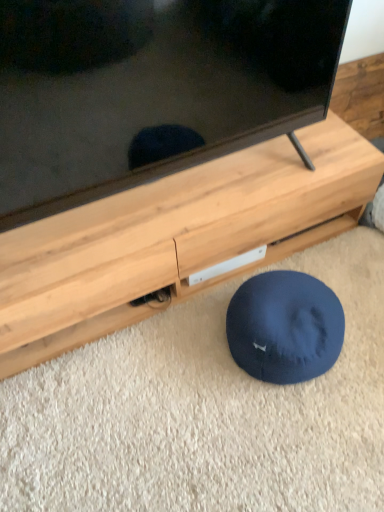
Where is `vacant space to the left of navy blue fabric dog bed at lower center`? The width and height of the screenshot is (384, 512). vacant space to the left of navy blue fabric dog bed at lower center is located at coordinates (188, 366).